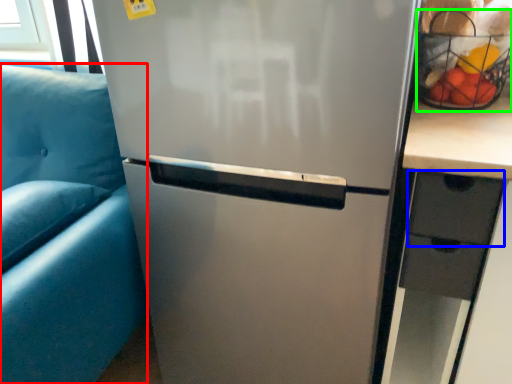
Question: Considering the real-world distances, which object is closest to armchair (highlighted by a red box)? drawer (highlighted by a blue box) or basket (highlighted by a green box).

Choices:
 (A) drawer
 (B) basket

Answer: (A)